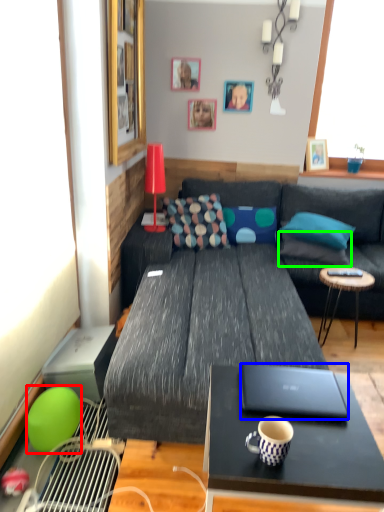
Question: Which is nearer to the ball (highlighted by a red box)? laptop (highlighted by a blue box) or pillow (highlighted by a green box).

Choices:
 (A) laptop
 (B) pillow

Answer: (A)